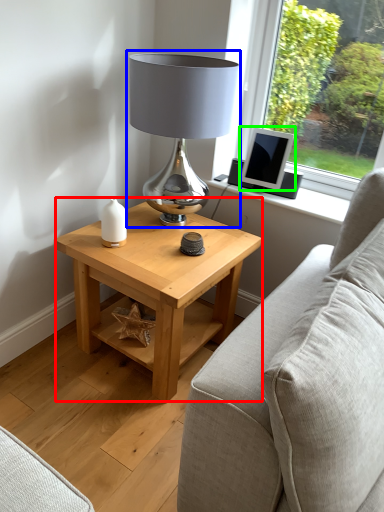
Question: Which object is positioned closest to table (highlighted by a red box)? Select from lamp (highlighted by a blue box) and computer monitor (highlighted by a green box).

Choices:
 (A) lamp
 (B) computer monitor

Answer: (A)